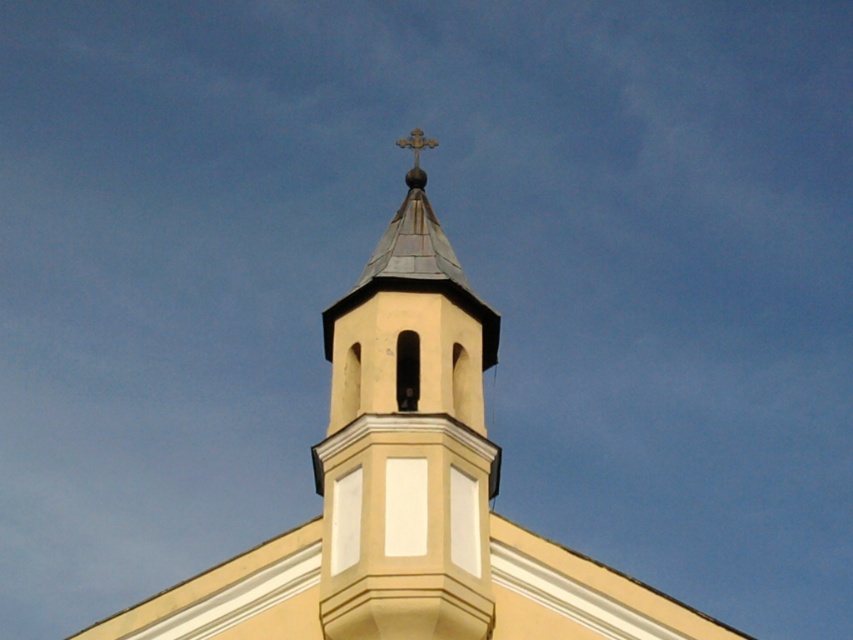
You are an architect designing a model of this church. You have a gold metallic cross at upper center that is 2 inches wide. The smooth beige steeple at center must be proportionally wider. What minimum width should the steeple be to maintain the correct proportions?

Since the smooth beige steeple at center is wider than the gold metallic cross at upper center, and the cross is 2 inches wide, the steeple must be at least 2.1 inches wide to maintain proper proportions.

You are standing in front of the church bell tower and notice two points marked on the tower. The first point is at coordinate point (347, 529) and the second is at point (407, 138). Which of these two points is closer to you?

Point (347, 529) is closer to the viewer than point (407, 138).

You are standing in front of the church and notice a point marked at coordinates (407,442). What does this point represent?

The point at coordinates (407,442) represents the location of the smooth beige steeple at center.